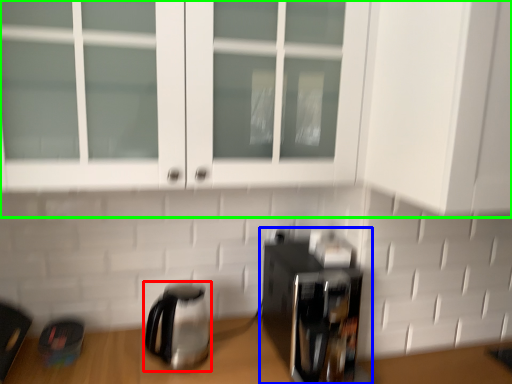
Question: Estimate the real-world distances between objects in this image. Which object is closer to kettle (highlighted by a red box), coffee maker (highlighted by a blue box) or cabinetry (highlighted by a green box)?

Choices:
 (A) coffee maker
 (B) cabinetry

Answer: (A)